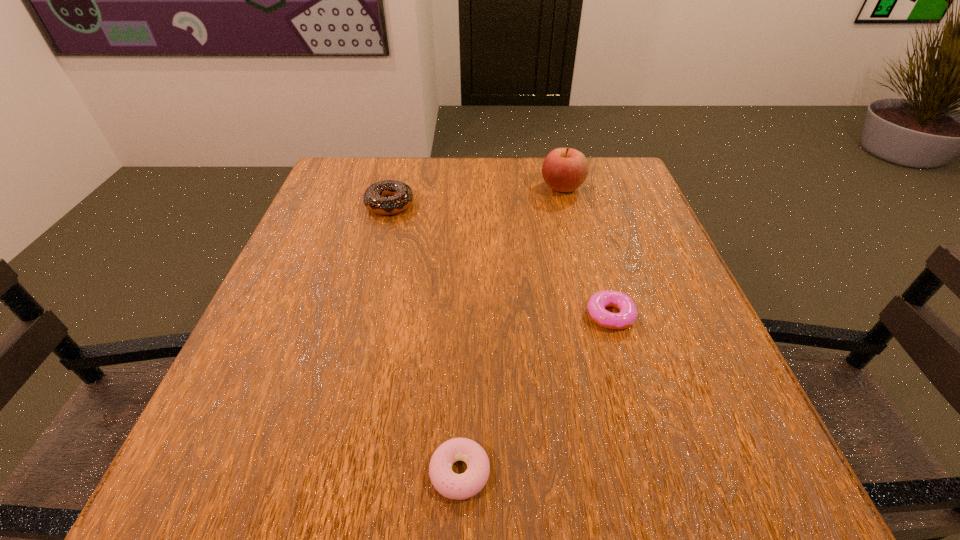
The width and height of the screenshot is (960, 540). In the image, there is a desktop. In order to click on vacant space at the near edge in this screenshot , I will do `click(358, 445)`.

Identify the location of vacant space at the left edge of the desktop. (276, 282).

In order to click on vacant region at the right edge of the desktop in this screenshot , I will do `click(613, 276)`.

Locate an element on the screen. This screenshot has height=540, width=960. vacant space at the far left corner is located at coordinates (336, 157).

I want to click on vacant area at the far right corner of the desktop, so click(602, 198).

Where is `free space at the near right corner of the desktop`? This screenshot has width=960, height=540. free space at the near right corner of the desktop is located at coordinates (727, 448).

Identify the location of unoccupied position between the tallest object and the second object from left to right. (511, 330).

Identify the location of free space between the nearest object and the tallest doughnut. (425, 338).

You are a GUI agent. You are given a task and a screenshot of the screen. Output one action in this format:
    pyautogui.click(x=<x>, y=<y>)
    Task: Click on the free space between the second tallest object and the nearest doughnut
    The height and width of the screenshot is (540, 960).
    Given the screenshot: What is the action you would take?
    pyautogui.click(x=425, y=338)

Identify the location of empty space that is in between the rightmost doughnut and the tallest doughnut. Image resolution: width=960 pixels, height=540 pixels. (500, 260).